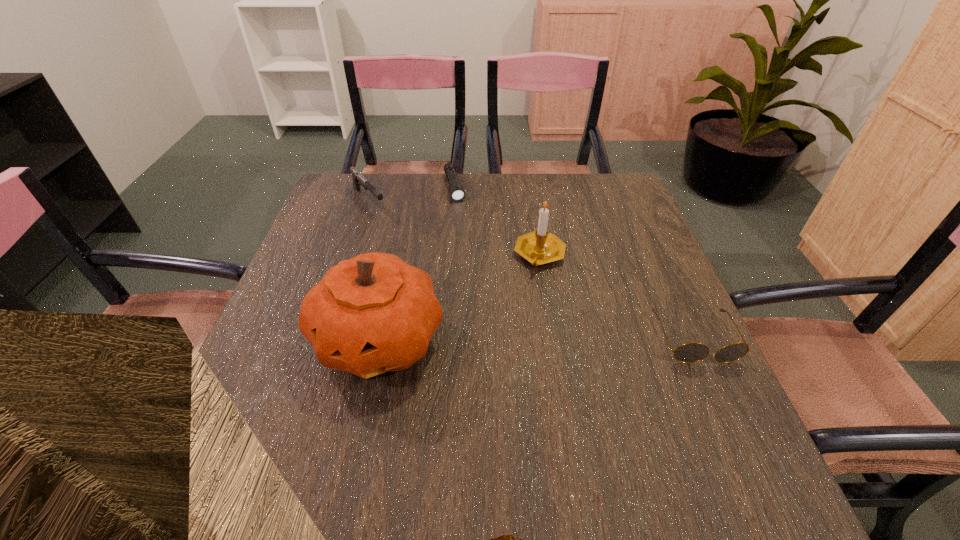
I want to click on vacant spot on the desktop that is between the pumpkin and the sunglasses and is positioned at the muzzle end of the third tallest object, so click(x=502, y=338).

Where is `free spot on the desktop that is between the tallest object and the sunglasses and is positioned at the lens end of the shortest object`? The image size is (960, 540). free spot on the desktop that is between the tallest object and the sunglasses and is positioned at the lens end of the shortest object is located at coordinates (503, 338).

Find the location of a particular element. vacant space on the desktop that is between the tallest object and the rightmost object and is positioned with a handle on the third farthest object is located at coordinates pos(569,338).